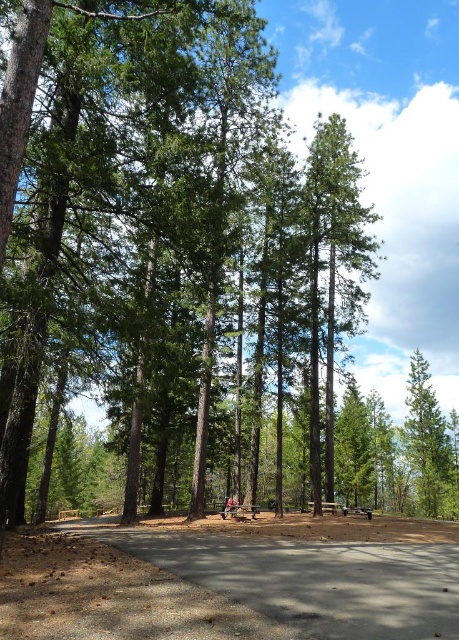
You are planning to have a picnic and want to sit under the shade provided by the green matte tree at right. However, there is a wooden park bench at center in the way. Can you move the bench to sit directly under the tree?

The green matte tree at right is positioned under the wooden park bench at center, meaning the bench is already located directly beneath the tree. Therefore, you can simply sit on the bench to enjoy the shade without moving it.